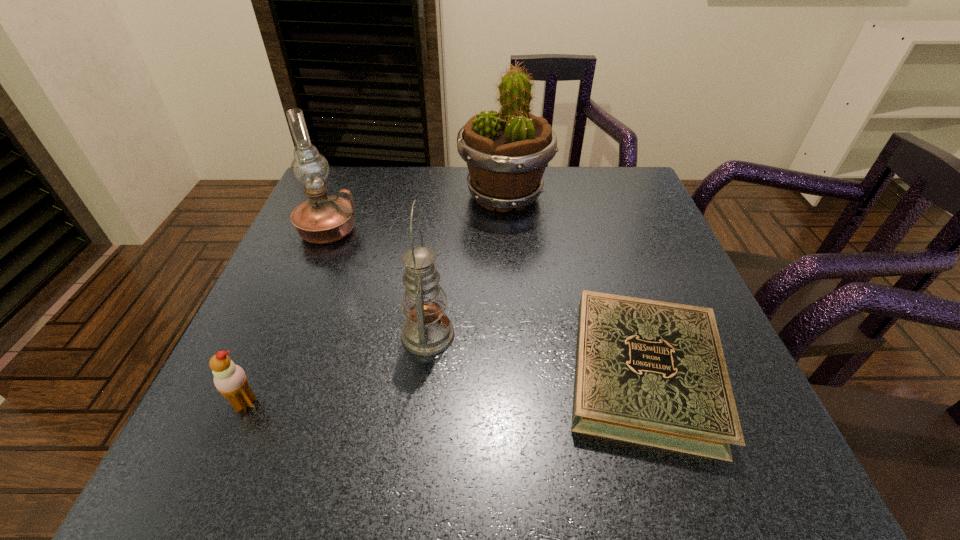
What are the coordinates of `flowerpot` in the screenshot? It's located at (506, 152).

Image resolution: width=960 pixels, height=540 pixels. Find the location of `the farther oil lamp`. the farther oil lamp is located at coordinates (323, 219).

Where is `the nearer oil lamp`? The image size is (960, 540). the nearer oil lamp is located at coordinates (427, 330).

The image size is (960, 540). What are the coordinates of `the fourth tallest object` in the screenshot? It's located at (230, 380).

Locate an element on the screen. The width and height of the screenshot is (960, 540). hardback book is located at coordinates 649,372.

Identify the location of vacant space situated on the front of the flowerpot. pos(508,239).

The image size is (960, 540). Identify the location of free space located on the front of the left oil lamp. (257, 403).

This screenshot has height=540, width=960. What are the coordinates of `vacant space located 0.050m on the left of the nearer oil lamp` in the screenshot? It's located at (374, 335).

Where is `vacant space located at the front with a straw on the second shortest object`? This screenshot has width=960, height=540. vacant space located at the front with a straw on the second shortest object is located at coordinates (216, 472).

Locate an element on the screen. This screenshot has width=960, height=540. vacant space situated on the left of the hardback book is located at coordinates (480, 373).